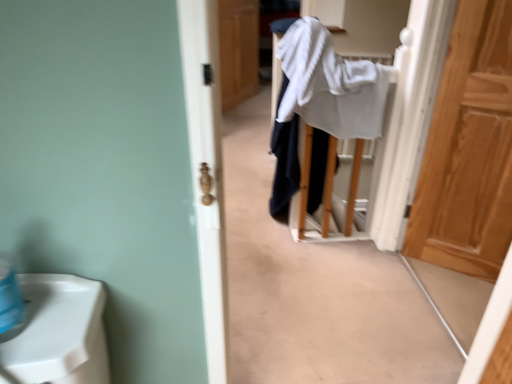
Question: From a real-world perspective, is white cotton bath towel at center on top of light brown wood door at right, the 2th door when ordered from left to right?

Choices:
 (A) no
 (B) yes

Answer: (B)

Question: Can you confirm if white cotton bath towel at center is wider than light brown wood door at right, the 2th door when ordered from left to right?

Choices:
 (A) no
 (B) yes

Answer: (B)

Question: Considering the relative positions of white cotton bath towel at center and light brown wood door at right, the first door from the right, in the image provided, is white cotton bath towel at center in front of light brown wood door at right, the first door from the right,?

Choices:
 (A) no
 (B) yes

Answer: (A)

Question: Is light brown wood door at right, the 2th door when ordered from left to right, at the back of white cotton bath towel at center?

Choices:
 (A) no
 (B) yes

Answer: (A)

Question: Considering the relative sizes of white cotton bath towel at center and light brown wood door at right, which is the second door from back to front, in the image provided, is white cotton bath towel at center taller than light brown wood door at right, which is the second door from back to front,?

Choices:
 (A) no
 (B) yes

Answer: (A)

Question: Does white cotton bath towel at center have a lesser width compared to light brown wood door at right, acting as the 1th door starting from the bottom?

Choices:
 (A) yes
 (B) no

Answer: (B)

Question: Considering the relative sizes of wooden door at center, placed as the 2th door when sorted from bottom to top, and light brown wood door at right, which is the second door from back to front, in the image provided, is wooden door at center, placed as the 2th door when sorted from bottom to top, thinner than light brown wood door at right, which is the second door from back to front,?

Choices:
 (A) yes
 (B) no

Answer: (B)

Question: Is wooden door at center, placed as the 2th door when sorted from bottom to top, to the right of light brown wood door at right, the 2th door when ordered from left to right, from the viewer's perspective?

Choices:
 (A) no
 (B) yes

Answer: (A)

Question: Is wooden door at center, arranged as the first door when viewed from the top, positioned with its back to light brown wood door at right, which appears as the second door when viewed from the top?

Choices:
 (A) yes
 (B) no

Answer: (B)

Question: Can you confirm if wooden door at center, the first door positioned from the back, is positioned to the left of light brown wood door at right, the 2th door when ordered from left to right?

Choices:
 (A) no
 (B) yes

Answer: (B)

Question: Does wooden door at center, the first door positioned from the left, have a smaller size compared to light brown wood door at right, which is the second door from back to front?

Choices:
 (A) no
 (B) yes

Answer: (A)

Question: Is wooden door at center, the 2th door from the front, further to the viewer compared to light brown wood door at right, acting as the 1th door starting from the bottom?

Choices:
 (A) yes
 (B) no

Answer: (A)

Question: From a real-world perspective, is wooden door at center, placed as the 2th door when sorted from bottom to top, beneath white cotton bath towel at center?

Choices:
 (A) no
 (B) yes

Answer: (B)